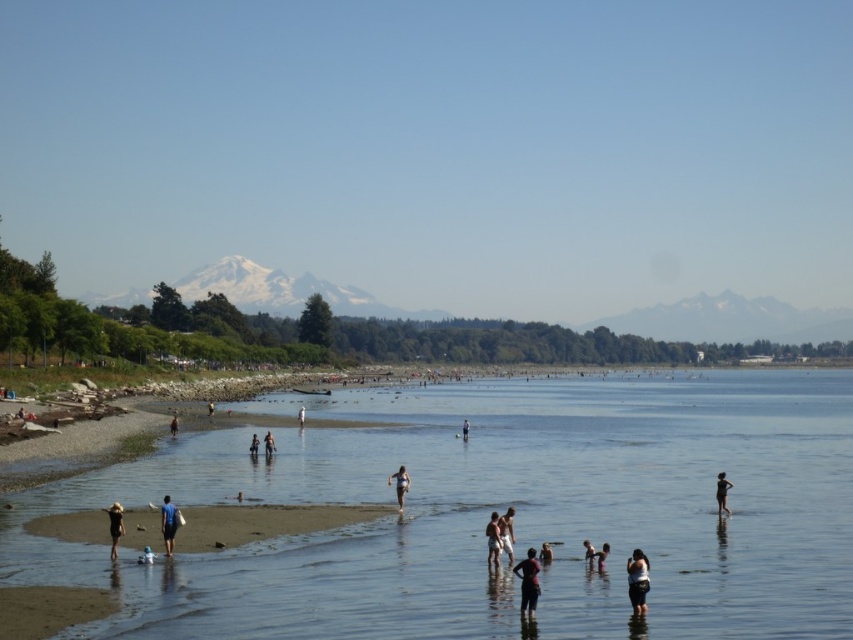
Image resolution: width=853 pixels, height=640 pixels. What do you see at coordinates (167, 524) in the screenshot? I see `blue fabric shorts at lower left` at bounding box center [167, 524].

Is blue fabric shorts at lower left positioned at the back of light blue fabric at center?

That is False.

Is point (167, 497) less distant than point (466, 420)?

Yes, it is.

Locate an element on the screen. The image size is (853, 640). blue fabric shorts at lower left is located at coordinates (167, 524).

Does dark red fabric swimsuit at center lie in front of light brown sand at lower center?

Yes, dark red fabric swimsuit at center is closer to the viewer.

Based on the photo, who is positioned more to the left, dark red fabric swimsuit at center or light brown sand at lower center?

Positioned to the left is light brown sand at lower center.

You are a GUI agent. You are given a task and a screenshot of the screen. Output one action in this format:
    pyautogui.click(x=<x>, y=<y>)
    Task: Click on the dark red fabric swimsuit at center
    
    Given the screenshot: What is the action you would take?
    pyautogui.click(x=527, y=580)

Is point (171, 515) positioned behind point (303, 422)?

No, it is not.

Does blue fabric shorts at lower left have a greater height compared to white fabric person at center?

Yes.

Which is in front, point (177, 522) or point (299, 417)?

Point (177, 522)

Where is `blue fabric shorts at lower left`? The width and height of the screenshot is (853, 640). blue fabric shorts at lower left is located at coordinates (167, 524).